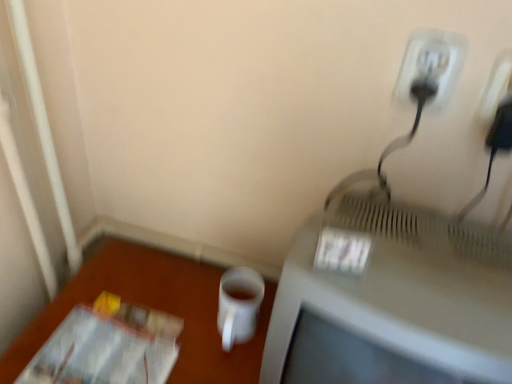
Identify the location of vacant area situated to the left side of white matte mug at lower center. The height and width of the screenshot is (384, 512). (170, 301).